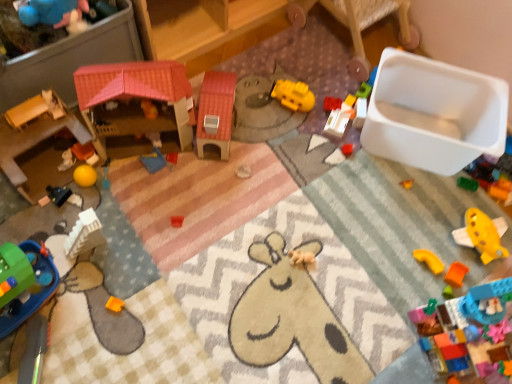
Where is `free space in front of bright red plastic blocks at center, which ranks as the seventh toy in right-to-left order`? The width and height of the screenshot is (512, 384). free space in front of bright red plastic blocks at center, which ranks as the seventh toy in right-to-left order is located at coordinates (323, 148).